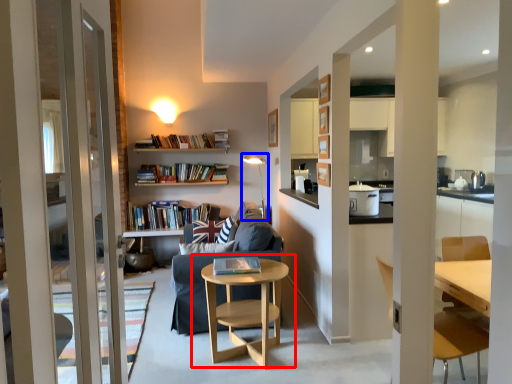
Question: Among these objects, which one is farthest to the camera, table (highlighted by a red box) or light fixture (highlighted by a blue box)?

Choices:
 (A) table
 (B) light fixture

Answer: (B)